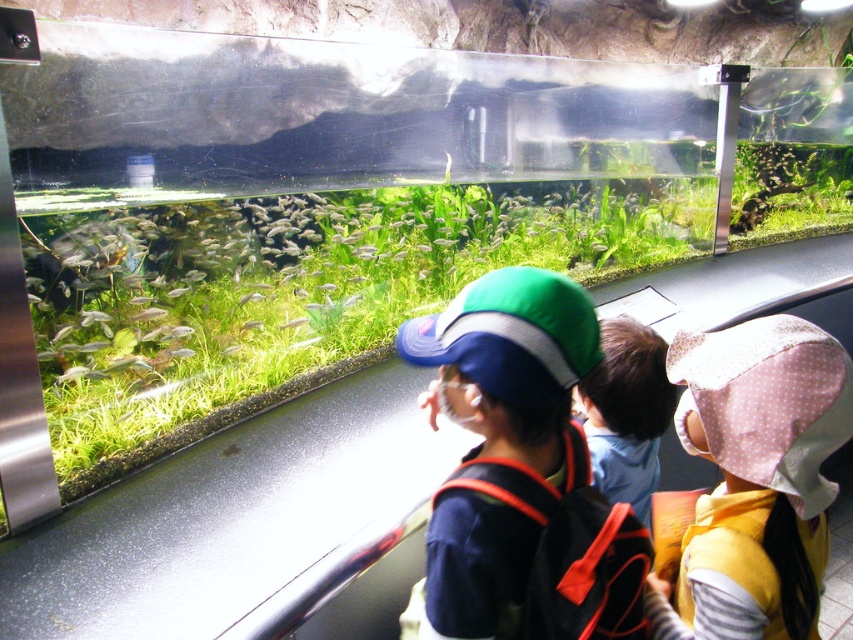
From the picture: Measure the distance between point (x=608, y=592) and camera.

32.20 inches

Is matte blue cap at center above blue fabric cap at center?

Correct, matte blue cap at center is located above blue fabric cap at center.

Does point (459, 627) come closer to viewer compared to point (636, 440)?

Yes, it is.

This screenshot has height=640, width=853. I want to click on matte blue cap at center, so click(518, 465).

Does pink dotted fabric hat at upper right have a greater height compared to translucent glass fish at center?

Yes, pink dotted fabric hat at upper right is taller than translucent glass fish at center.

Is point (746, 605) positioned before point (285, 328)?

Yes, it is in front of point (285, 328).

You are a GUI agent. You are given a task and a screenshot of the screen. Output one action in this format:
    pyautogui.click(x=<x>, y=<y>)
    Task: Click on the pink dotted fabric hat at upper right
    This screenshot has width=853, height=640.
    Given the screenshot: What is the action you would take?
    pyautogui.click(x=755, y=477)

Is point (645, 360) positioned in front of point (305, 323)?

Yes, it is in front of point (305, 323).

Is point (666, 349) farther from camera compared to point (282, 323)?

No, it is not.

I want to click on blue fabric cap at center, so click(627, 412).